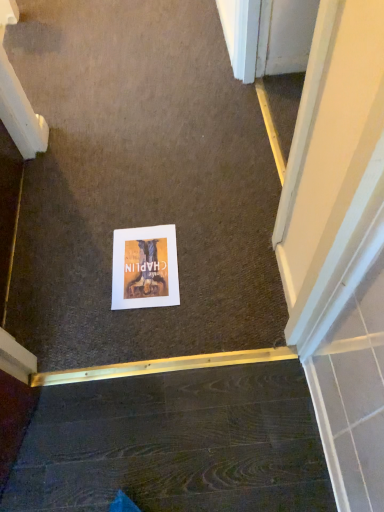
Find the location of `vacant area that is situated to the right of white paper at center`. vacant area that is situated to the right of white paper at center is located at coordinates (211, 268).